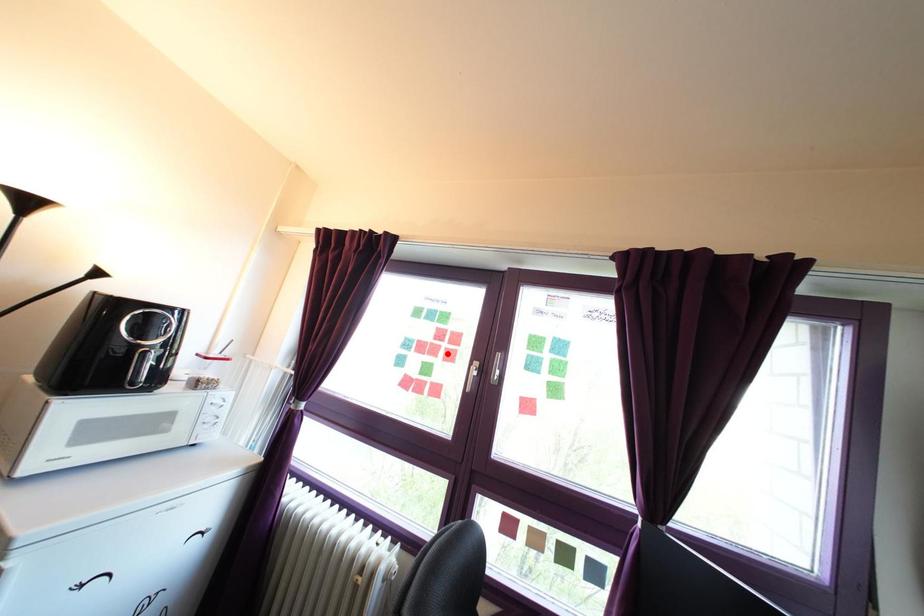
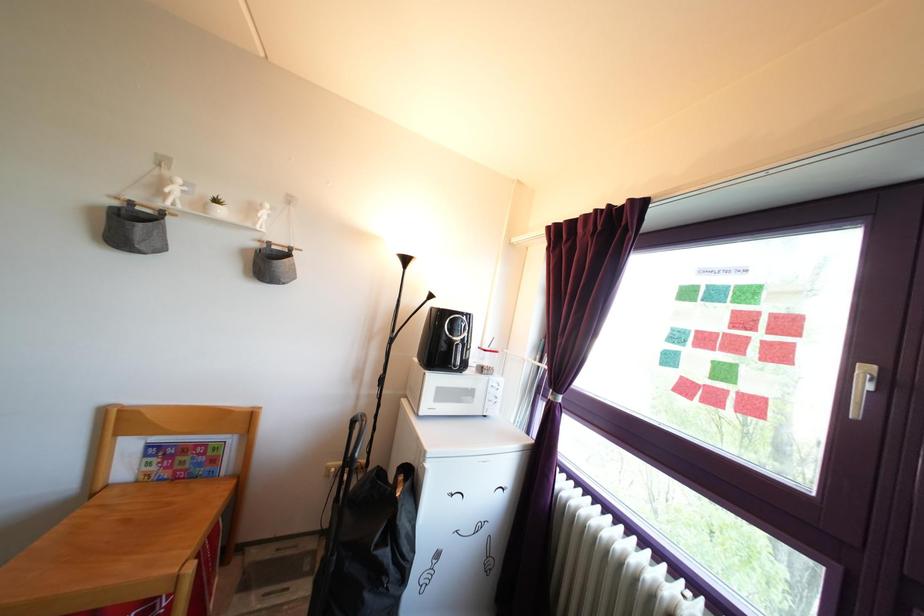
Locate, in the second image, the point that corresponds to the highlighted location in the first image.

(761, 345)